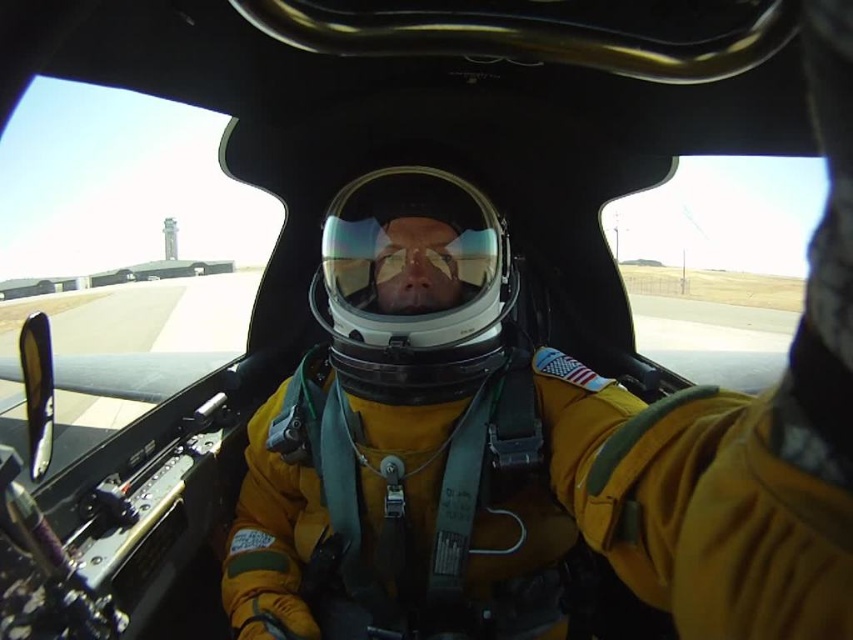
You are standing in the cockpit of a fighter jet and need to reach a point marked at coordinates point (392, 317). If your arm can reach up to 3 feet, can you touch that point?

The point (392, 317) is 4.11 feet away from you, which is beyond your arm reach of 3 feet. Therefore, you cannot touch it.

You are a flight attendant preparing for a flight and need to choose a helmet that fits under the cockpit ceiling. The ceiling height allows only helmets with a height of 30 cm. Which helmet between the yellow fabric helmet at center and the transparent plastic helmet at center should you choose?

The transparent plastic helmet at center has a smaller size compared to the yellow fabric helmet at center, so it is more likely to fit under the cockpit ceiling with a 30 cm height limit.